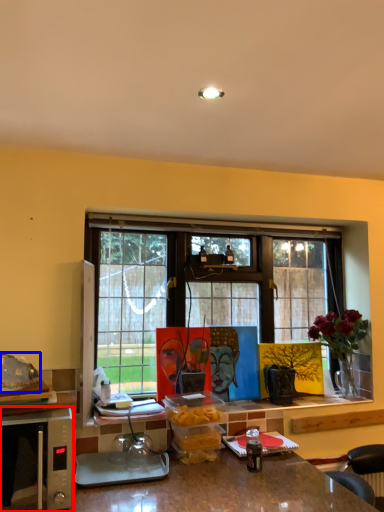
Question: Which object is further to the camera taking this photo, microwave oven (highlighted by a red box) or food (highlighted by a blue box)?

Choices:
 (A) microwave oven
 (B) food

Answer: (B)